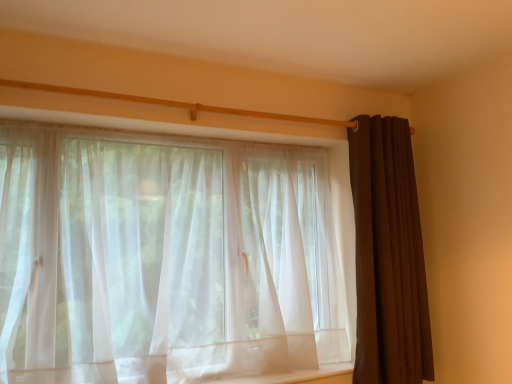
Question: From the image's perspective, is brown textured curtain at right, marked as the 2th curtain in a left-to-right arrangement, over sheer white curtain at center, the 2th curtain positioned from the right?

Choices:
 (A) yes
 (B) no

Answer: (A)

Question: Can you confirm if brown textured curtain at right, which ranks as the 1th curtain in right-to-left order, is shorter than sheer white curtain at center, the 2th curtain positioned from the right?

Choices:
 (A) no
 (B) yes

Answer: (A)

Question: From a real-world perspective, is brown textured curtain at right, marked as the 2th curtain in a left-to-right arrangement, on top of sheer white curtain at center, the first curtain in the left-to-right sequence?

Choices:
 (A) no
 (B) yes

Answer: (B)

Question: Is brown textured curtain at right, marked as the 2th curtain in a left-to-right arrangement, in front of sheer white curtain at center, the 2th curtain positioned from the right?

Choices:
 (A) yes
 (B) no

Answer: (B)

Question: Is brown textured curtain at right, which ranks as the 1th curtain in right-to-left order, not inside sheer white curtain at center, the 2th curtain positioned from the right?

Choices:
 (A) no
 (B) yes

Answer: (B)

Question: Is brown textured curtain at right, which ranks as the 1th curtain in right-to-left order, to the right of sheer white curtain at center, the 2th curtain positioned from the right, from the viewer's perspective?

Choices:
 (A) yes
 (B) no

Answer: (A)

Question: From the image's perspective, would you say sheer white curtain at center, the first curtain in the left-to-right sequence, is positioned over brown textured curtain at right, which ranks as the 1th curtain in right-to-left order?

Choices:
 (A) no
 (B) yes

Answer: (A)

Question: From a real-world perspective, is sheer white curtain at center, the 2th curtain positioned from the right, beneath brown textured curtain at right, marked as the 2th curtain in a left-to-right arrangement?

Choices:
 (A) no
 (B) yes

Answer: (B)

Question: Is sheer white curtain at center, the 2th curtain positioned from the right, oriented away from brown textured curtain at right, which ranks as the 1th curtain in right-to-left order?

Choices:
 (A) no
 (B) yes

Answer: (A)

Question: Is sheer white curtain at center, the first curtain in the left-to-right sequence, far away from brown textured curtain at right, marked as the 2th curtain in a left-to-right arrangement?

Choices:
 (A) yes
 (B) no

Answer: (B)

Question: Can you confirm if sheer white curtain at center, the first curtain in the left-to-right sequence, is taller than brown textured curtain at right, marked as the 2th curtain in a left-to-right arrangement?

Choices:
 (A) yes
 (B) no

Answer: (B)

Question: Can you confirm if sheer white curtain at center, the first curtain in the left-to-right sequence, is wider than brown textured curtain at right, which ranks as the 1th curtain in right-to-left order?

Choices:
 (A) yes
 (B) no

Answer: (A)

Question: From their relative heights in the image, would you say sheer white curtain at center, the first curtain in the left-to-right sequence, is taller or shorter than brown textured curtain at right, which ranks as the 1th curtain in right-to-left order?

Choices:
 (A) short
 (B) tall

Answer: (A)